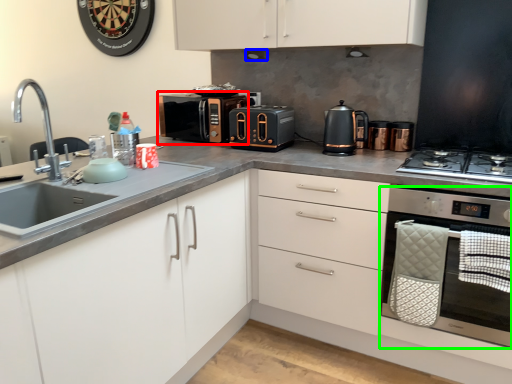
Question: Based on their relative distances, which object is farther from microwave oven (highlighted by a red box)? Choose from exhaust hood (highlighted by a blue box) and home appliance (highlighted by a green box).

Choices:
 (A) exhaust hood
 (B) home appliance

Answer: (B)